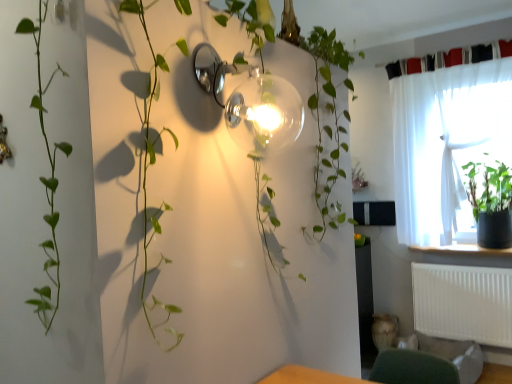
Image resolution: width=512 pixels, height=384 pixels. I want to click on free spot below black fabric curtain at upper right, which ranks as the second curtain in bottom-to-top order (from a real-world perspective), so click(447, 54).